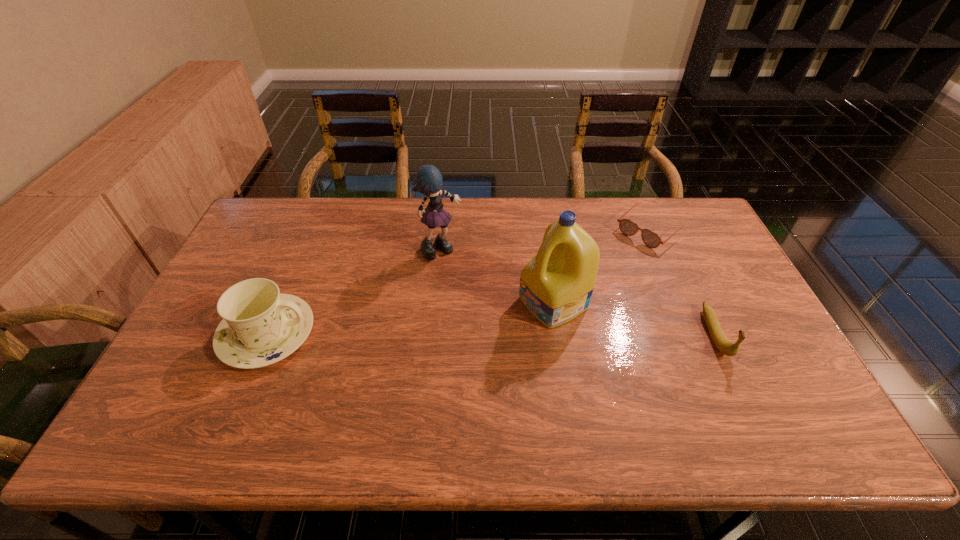
Image resolution: width=960 pixels, height=540 pixels. I want to click on vacant area between the chinaware and the banana, so click(x=491, y=334).

Locate an element on the screen. The height and width of the screenshot is (540, 960). free spot between the shortest object and the fourth tallest object is located at coordinates (683, 282).

The height and width of the screenshot is (540, 960). In order to click on free space that is in between the chinaware and the second object from left to right in this screenshot , I will do `click(354, 292)`.

Where is `vacant area that lies between the third tallest object and the rag doll`? This screenshot has height=540, width=960. vacant area that lies between the third tallest object and the rag doll is located at coordinates (354, 292).

Locate an element on the screen. The width and height of the screenshot is (960, 540). free area in between the banana and the detergent is located at coordinates (634, 319).

Identify which object is the second nearest to the banana. Please provide its 2D coordinates. Your answer should be formatted as a tuple, i.e. [(x, y)], where the tuple contains the x and y coordinates of a point satisfying the conditions above.

[(556, 285)]

Locate which object ranks third in proximity to the fourth tallest object. Please provide its 2D coordinates. Your answer should be formatted as a tuple, i.e. [(x, y)], where the tuple contains the x and y coordinates of a point satisfying the conditions above.

[(428, 180)]